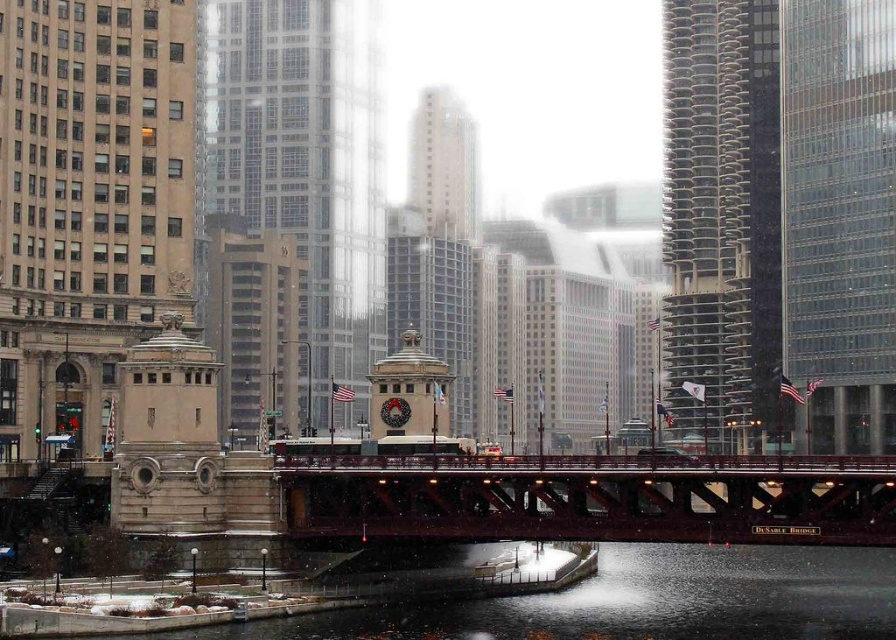
Does clear glass skyscraper at upper right appear on the left side of glassy reflective skyscraper at center right?

Incorrect, clear glass skyscraper at upper right is not on the left side of glassy reflective skyscraper at center right.

Between point (855, 392) and point (711, 42), which one is positioned in front?

Point (855, 392)

Identify the location of clear glass skyscraper at upper right. Image resolution: width=896 pixels, height=640 pixels. (840, 220).

Can you confirm if beige stone tower at left is positioned to the right of glassy reflective skyscraper at center right?

In fact, beige stone tower at left is to the left of glassy reflective skyscraper at center right.

You are a GUI agent. You are given a task and a screenshot of the screen. Output one action in this format:
    pyautogui.click(x=<x>, y=<y>)
    Task: Click on the beige stone tower at left
    The width and height of the screenshot is (896, 640).
    Given the screenshot: What is the action you would take?
    pyautogui.click(x=89, y=204)

You are a GUI agent. You are given a task and a screenshot of the screen. Output one action in this format:
    pyautogui.click(x=<x>, y=<y>)
    Task: Click on the smooth concrete river at center
    Image resolution: width=896 pixels, height=640 pixels.
    Given the screenshot: What is the action you would take?
    pyautogui.click(x=638, y=602)

Can you confirm if smooth concrete river at center is positioned below white glass building at center?

Yes.

Which is behind, point (338, 630) or point (442, 138)?

Point (442, 138)

I want to click on smooth concrete river at center, so click(638, 602).